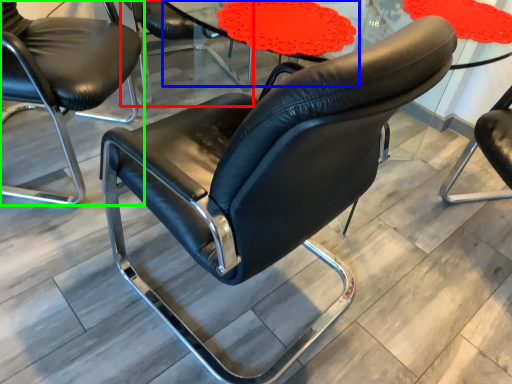
Question: Which object is the closest to the chair (highlighted by a red box)? Choose among these: round table (highlighted by a blue box) or chair (highlighted by a green box).

Choices:
 (A) round table
 (B) chair

Answer: (A)